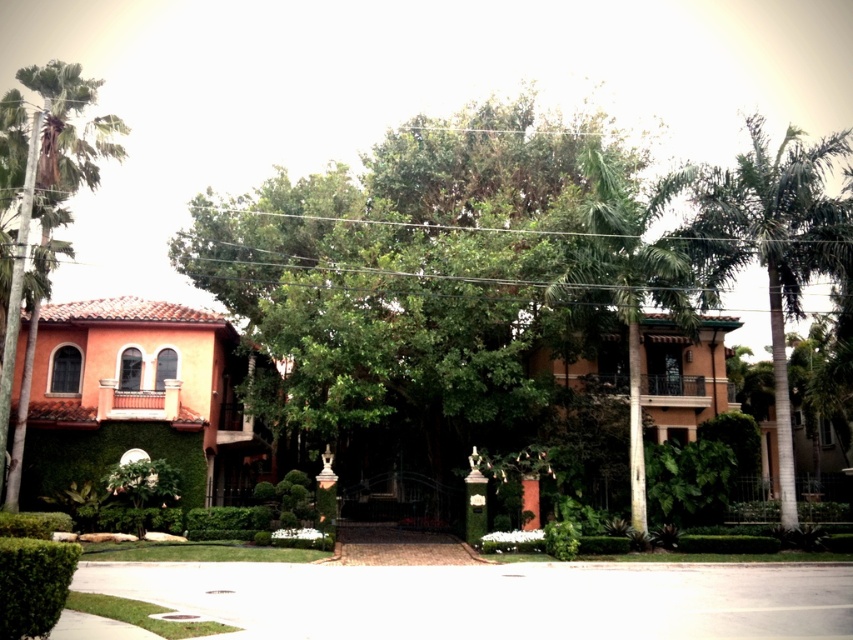
Question: Which point is closer to the camera?

Choices:
 (A) green leafy tree at center
 (B) green leafy palm tree at center

Answer: (B)

Question: Is green leafy tree at center further to camera compared to green leafy palm tree at right?

Choices:
 (A) yes
 (B) no

Answer: (B)

Question: Which point appears closest to the camera in this image?

Choices:
 (A) (32, 342)
 (B) (593, 173)

Answer: (B)

Question: Is green leafy tree at center thinner than green leafy palm tree at center?

Choices:
 (A) yes
 (B) no

Answer: (B)

Question: Considering the real-world distances, which object is farthest from the green leafy palm tree at right?

Choices:
 (A) green leafy palm tree at center
 (B) green leafy tree at center

Answer: (B)

Question: Is green leafy tree at center smaller than green leafy palm tree at left?

Choices:
 (A) no
 (B) yes

Answer: (B)